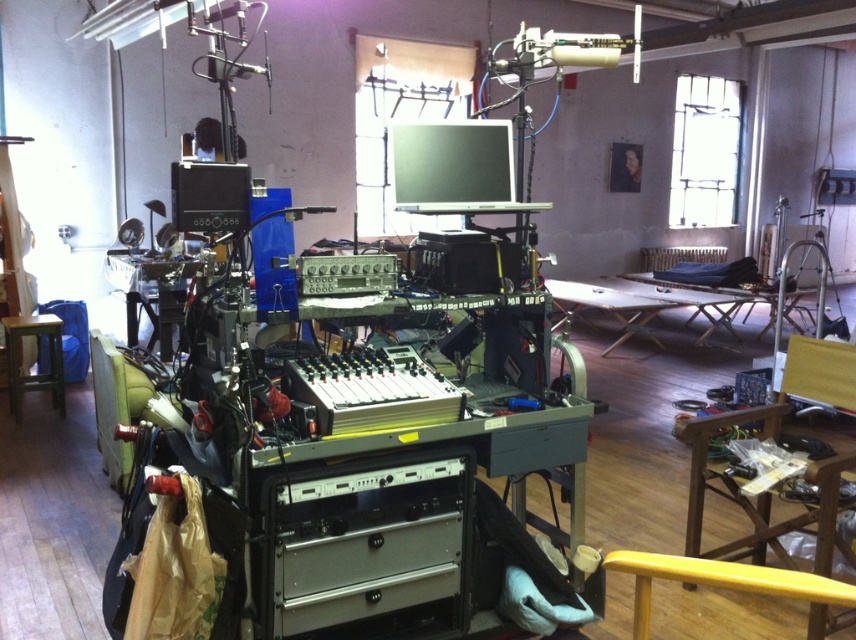
Between wooden folding table at center and wooden stool at lower left, which one appears on the right side from the viewer's perspective?

From the viewer's perspective, wooden folding table at center appears more on the right side.

In the scene shown: Does wooden folding table at center appear on the left side of wooden stool at lower left?

Incorrect, wooden folding table at center is not on the left side of wooden stool at lower left.

Which is in front, point (739, 307) or point (33, 376)?

Point (33, 376) is in front.

Where is `wooden folding table at center`? This screenshot has height=640, width=856. wooden folding table at center is located at coordinates (645, 305).